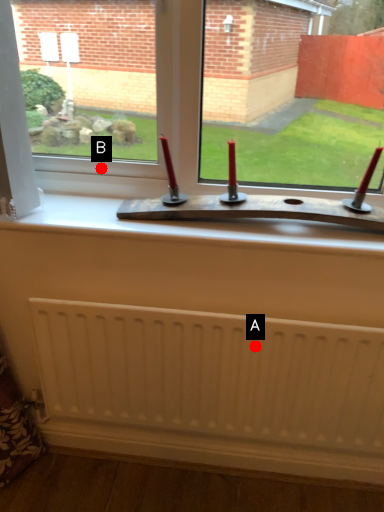
Question: Two points are circled on the image, labeled by A and B beside each circle. Among these points, which one is nearest to the camera?

Choices:
 (A) A is closer
 (B) B is closer

Answer: (A)